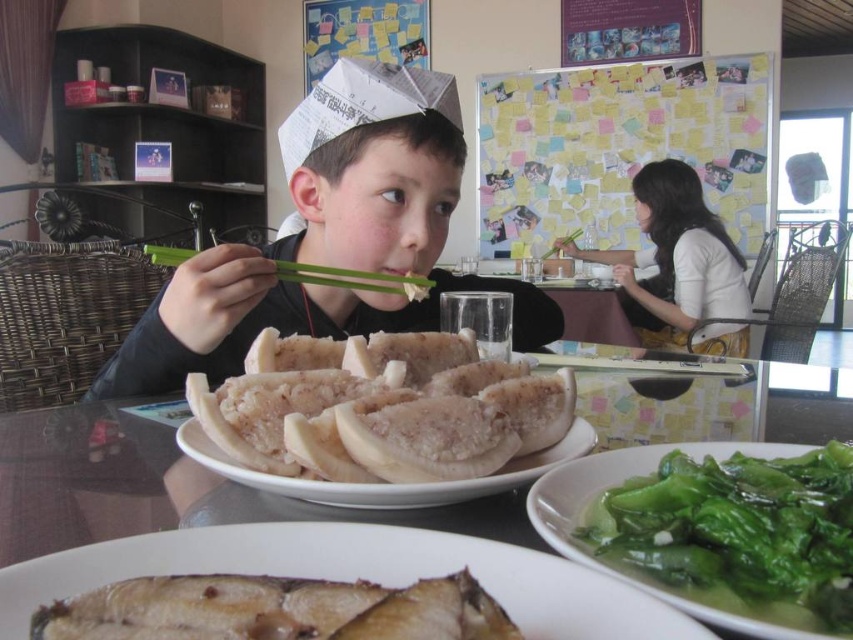
Question: Which object appears farthest from the camera in this image?

Choices:
 (A) white matte plate at center
 (B) green leafy vegetable at lower right
 (C) yellow sticky notes at upper center
 (D) green bamboo chopsticks at center

Answer: (C)

Question: Can you confirm if white soft rice cake at center is positioned to the left of white matte plate at center?

Choices:
 (A) no
 (B) yes

Answer: (A)

Question: Which of these objects is positioned farthest from the brown glazed fish at lower left?

Choices:
 (A) yellow sticky notes at upper center
 (B) green bamboo chopsticks at center
 (C) brown matte fish at lower left

Answer: (A)

Question: Can you confirm if matte white paper hat at center is bigger than brown matte fish at lower left?

Choices:
 (A) no
 (B) yes

Answer: (B)

Question: Can you confirm if white soft rice cake at center is smaller than green leafy vegetable at lower right?

Choices:
 (A) no
 (B) yes

Answer: (A)

Question: Which object appears farthest from the camera in this image?

Choices:
 (A) green bamboo chopsticks at center
 (B) green leafy vegetable at lower right

Answer: (A)